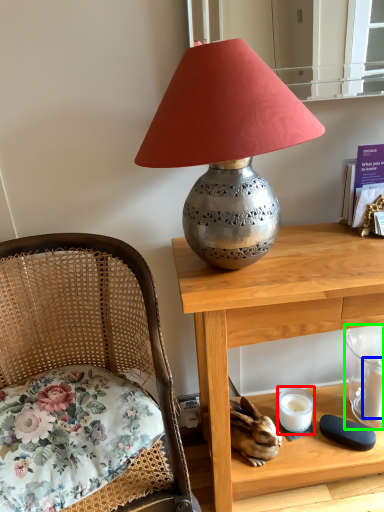
Question: Which object is the farthest from candle holder (highlighted by a red box)? Choose among these: candle (highlighted by a blue box) or candle holder (highlighted by a green box).

Choices:
 (A) candle
 (B) candle holder

Answer: (A)